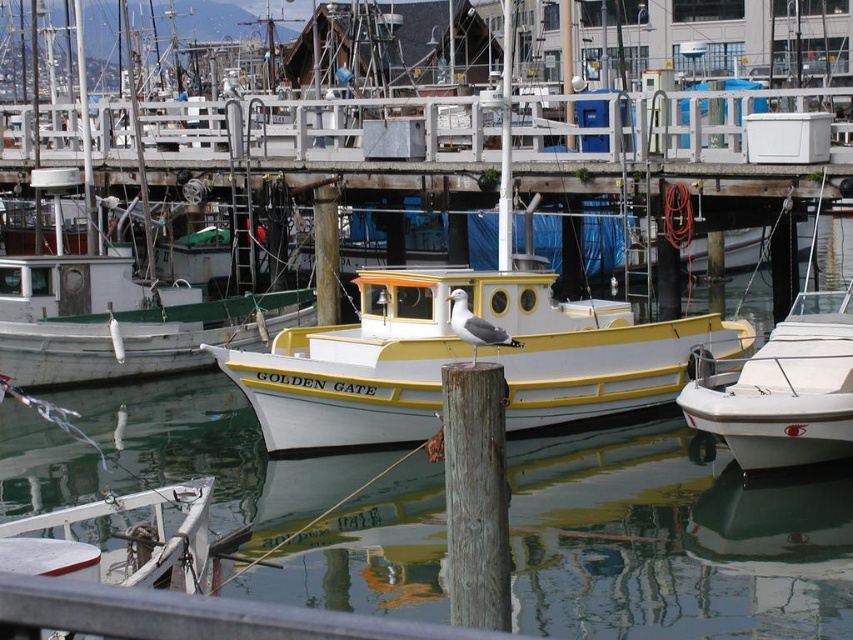
Question: Does white/yellow fiberglass boat at center have a larger size compared to gray wood post at center?

Choices:
 (A) no
 (B) yes

Answer: (A)

Question: From the image, what is the correct spatial relationship of clear water at center in relation to gray wood post at center?

Choices:
 (A) right
 (B) left

Answer: (B)

Question: Which object is closer to the camera taking this photo?

Choices:
 (A) white matte boat at right
 (B) white matte boat at center

Answer: (A)

Question: Which of the following is the closest to the observer?

Choices:
 (A) gray wood post at center
 (B) clear water at center
 (C) white/yellow fiberglass boat at center

Answer: (A)

Question: Does clear water at center appear over white matte boat at center?

Choices:
 (A) no
 (B) yes

Answer: (A)

Question: Which of the following is the farthest from the observer?

Choices:
 (A) gray wood post at center
 (B) clear water at center
 (C) white/yellow fiberglass boat at center
 (D) white matte boat at center

Answer: (D)